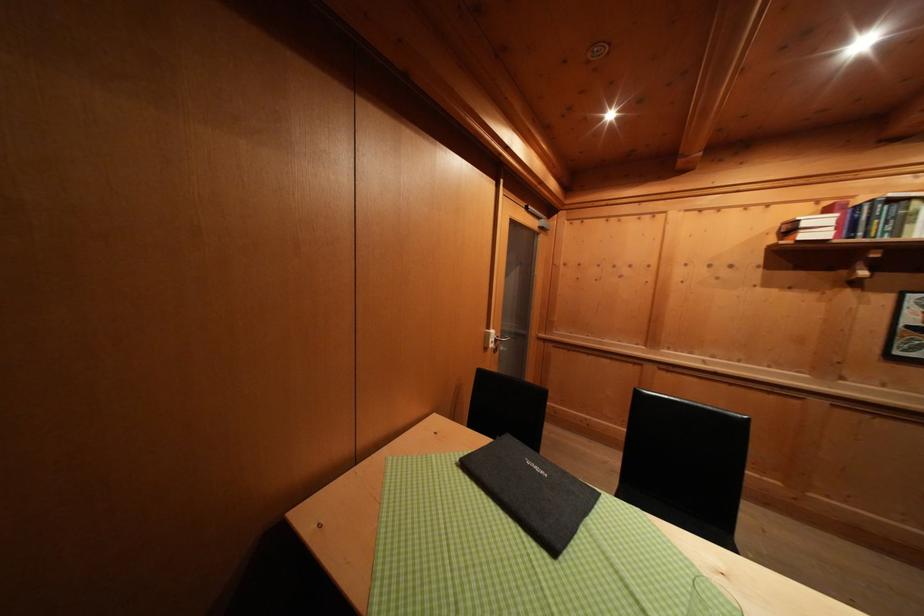
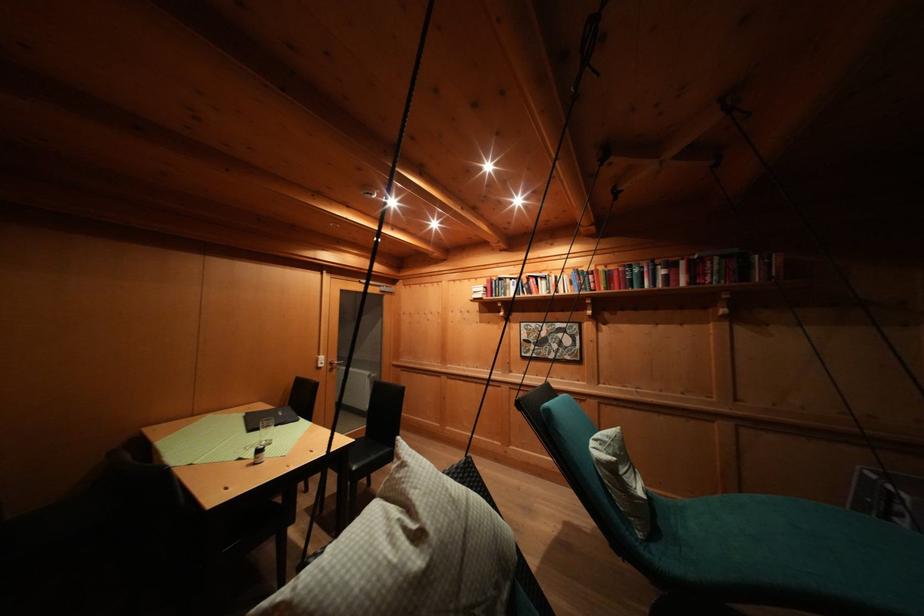
Where in the second image is the point corresponding to [499,338] from the first image?

(327, 362)